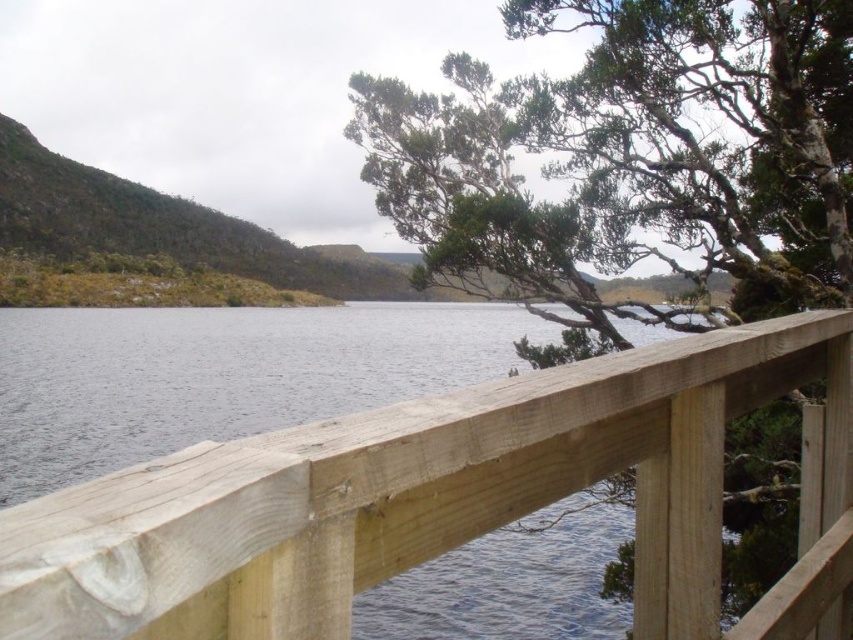
Question: Does natural wood railing at center have a greater width compared to green textured tree at upper center?

Choices:
 (A) yes
 (B) no

Answer: (B)

Question: Which point is closer to the camera?

Choices:
 (A) green textured tree at upper center
 (B) natural wood railing at center

Answer: (B)

Question: Which point is farther to the camera?

Choices:
 (A) green textured tree at upper center
 (B) natural wood railing at center

Answer: (A)

Question: Does natural wood railing at center appear under green textured tree at upper center?

Choices:
 (A) yes
 (B) no

Answer: (A)

Question: Can you confirm if natural wood railing at center is positioned below green textured tree at upper center?

Choices:
 (A) no
 (B) yes

Answer: (B)

Question: Which object is farther from the camera taking this photo?

Choices:
 (A) natural wood railing at center
 (B) green textured tree at upper center

Answer: (B)